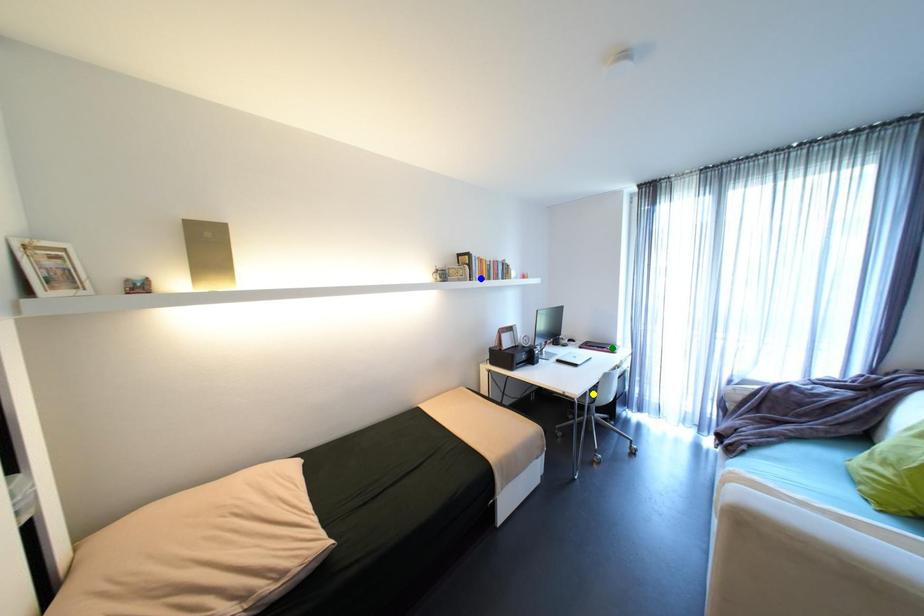
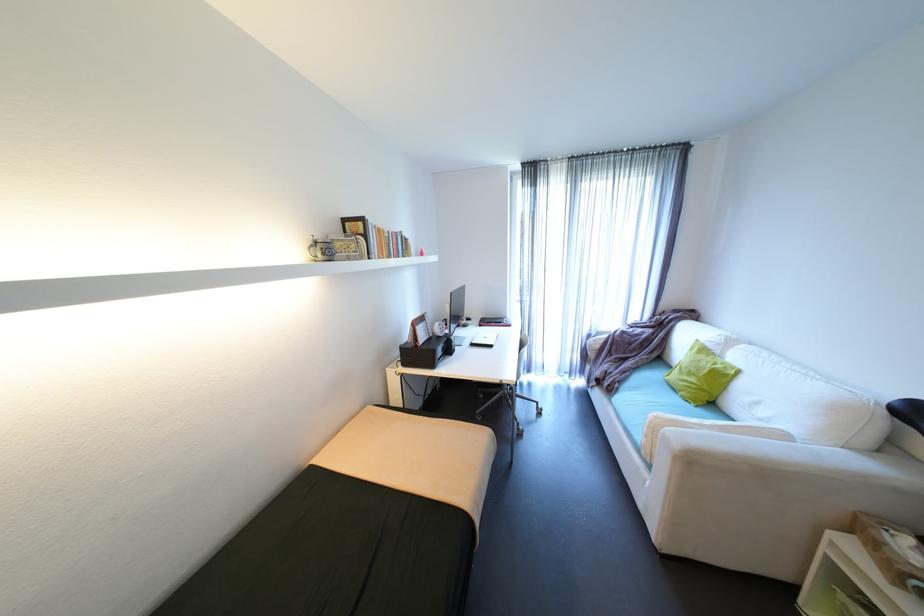
I am providing you with two images of the same scene from different viewpoints. Three points are marked in image1. Which point corresponds to a part or object that is occluded in image2?In image1, three points are marked. Which of them correspond to a part or object that is occluded in image2?Among the three points shown in image1, which one corresponds to a part or object that is no longer visible due to occlusion in image2?

yellow point